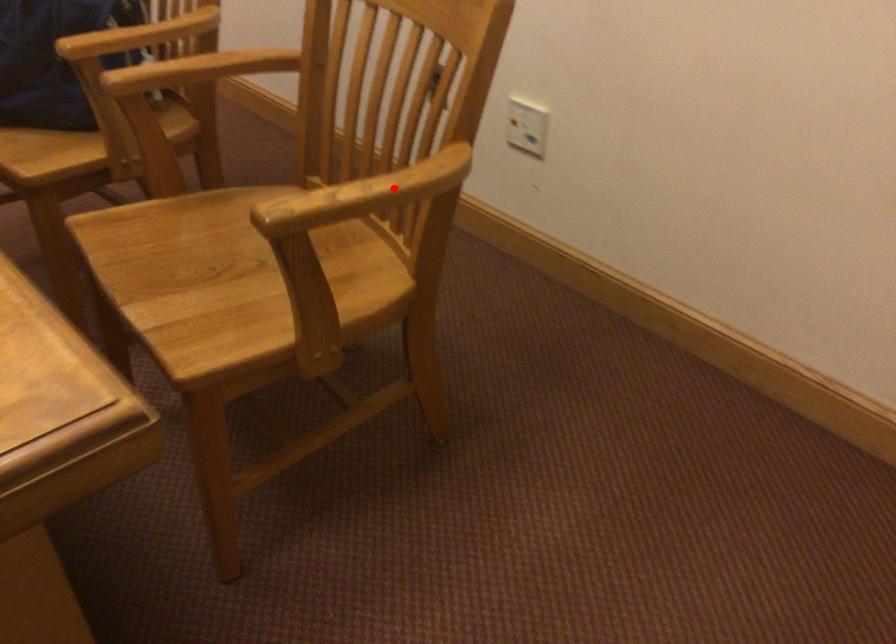
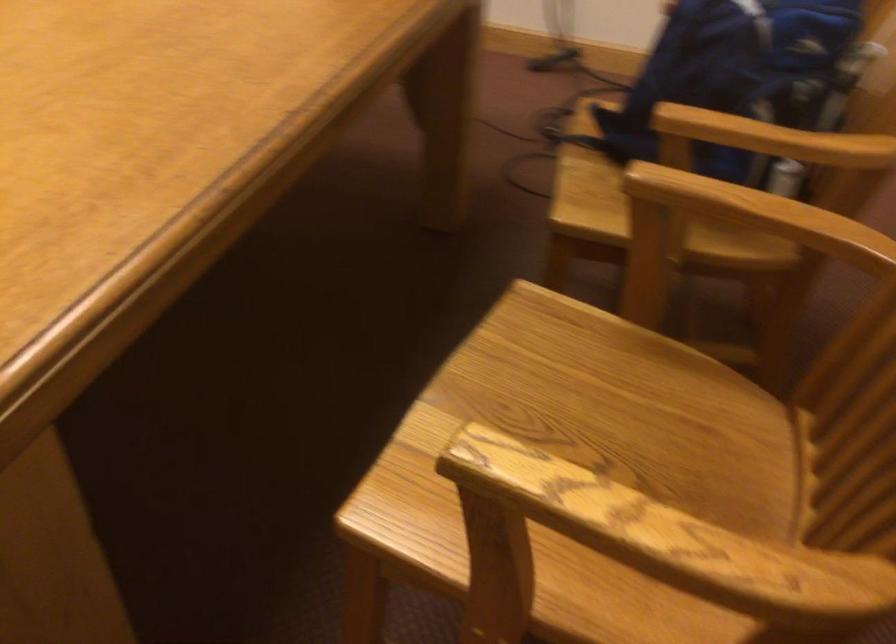
Question: I am providing you with two images of the same scene from different viewpoints. Image1 has a red point marked. In image2, the corresponding 3D location appears at what relative position? Reply with the corresponding letter.

Choices:
 (A) Closer
 (B) Farther

Answer: (A)